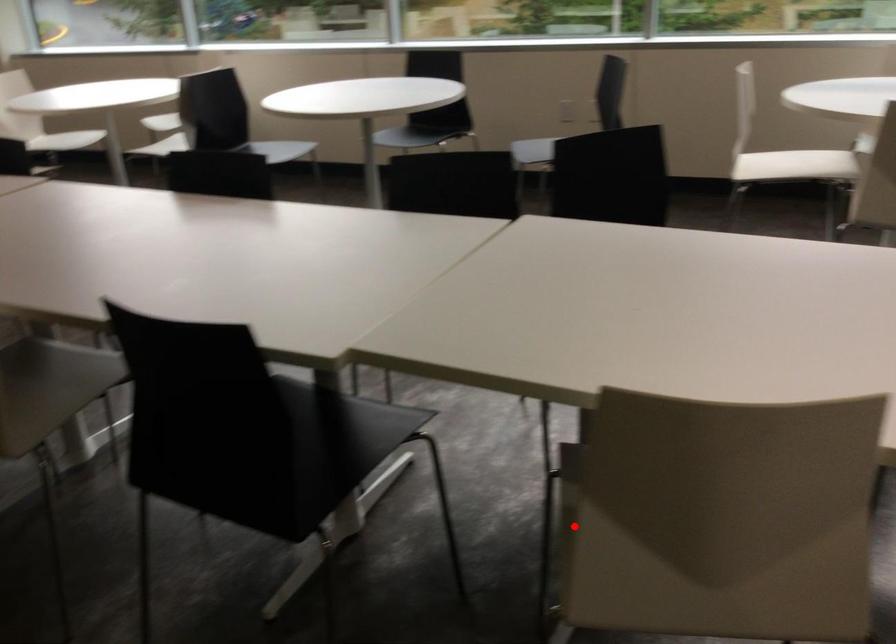
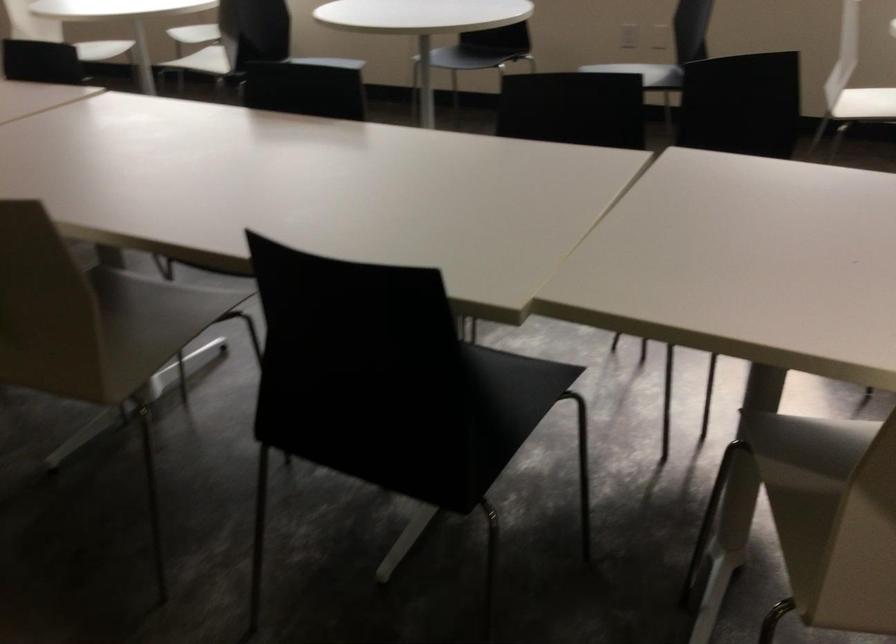
Locate, in the second image, the point that corresponds to the highlighted location in the first image.

(831, 516)